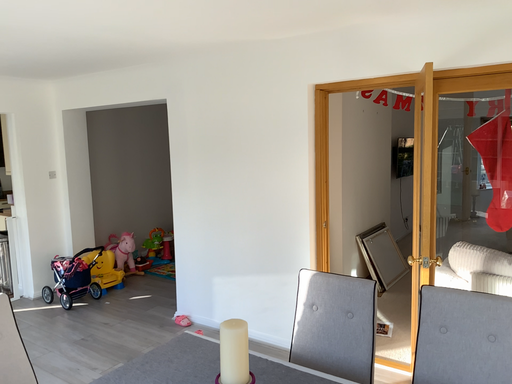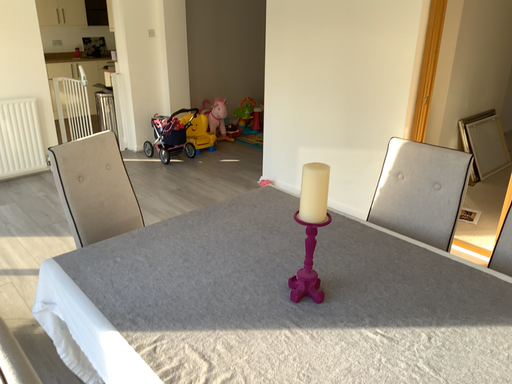
Question: How did the camera likely rotate when shooting the video?

Choices:
 (A) rotated left
 (B) rotated right

Answer: (A)